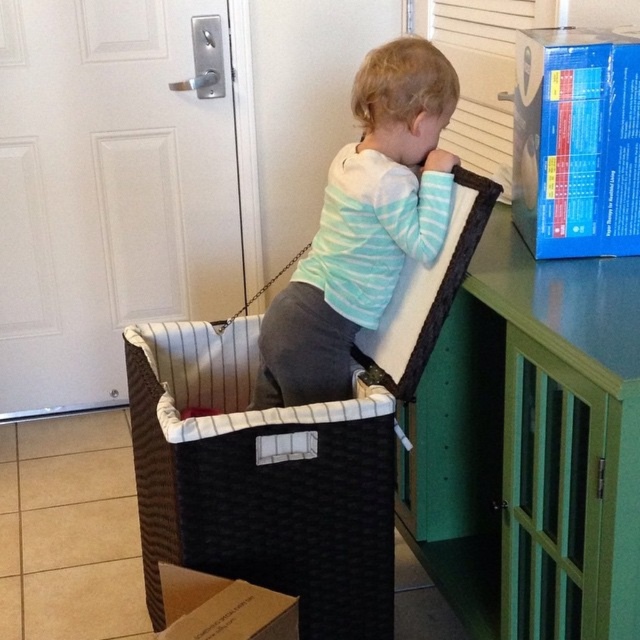
Question: Does black woven basket at center appear under blue cardboard box at upper right?

Choices:
 (A) no
 (B) yes

Answer: (B)

Question: Among these points, which one is nearest to the camera?

Choices:
 (A) (288, 595)
 (B) (586, 68)
 (C) (400, 339)
 (D) (278, 369)

Answer: (A)

Question: Which object is closer to the camera taking this photo?

Choices:
 (A) black woven basket at center
 (B) cardboard at lower left
 (C) light blue striped shirt at upper center
 (D) blue cardboard box at upper right

Answer: (B)

Question: Can you confirm if light blue striped shirt at upper center is positioned above blue cardboard box at upper right?

Choices:
 (A) yes
 (B) no

Answer: (B)

Question: Which point is farther to the camera?

Choices:
 (A) cardboard at lower left
 (B) light blue striped shirt at upper center
 (C) black woven basket at center
 (D) blue cardboard box at upper right

Answer: (B)

Question: Observing the image, what is the correct spatial positioning of black woven basket at center in reference to blue cardboard box at upper right?

Choices:
 (A) right
 (B) left

Answer: (B)